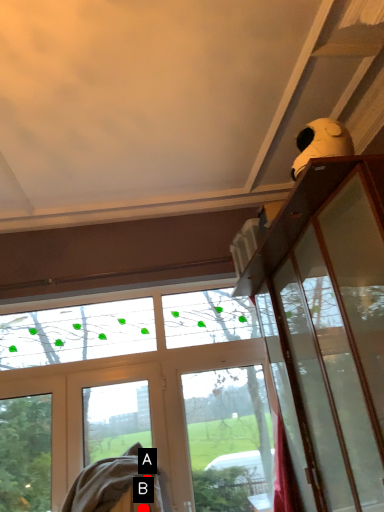
Question: Two points are circled on the image, labeled by A and B beside each circle. Which point appears closest to the camera in this image?

Choices:
 (A) A is closer
 (B) B is closer

Answer: (B)